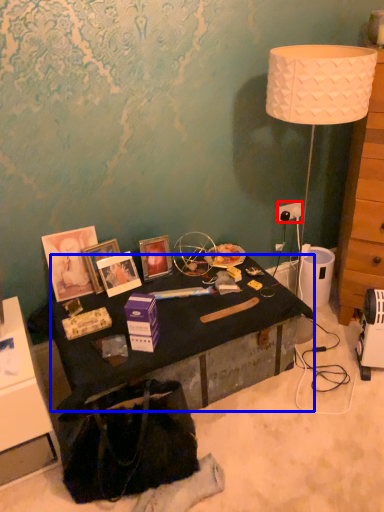
Question: Which object is closer to the camera taking this photo, power outlet (highlighted by a red box) or desk (highlighted by a blue box)?

Choices:
 (A) power outlet
 (B) desk

Answer: (B)